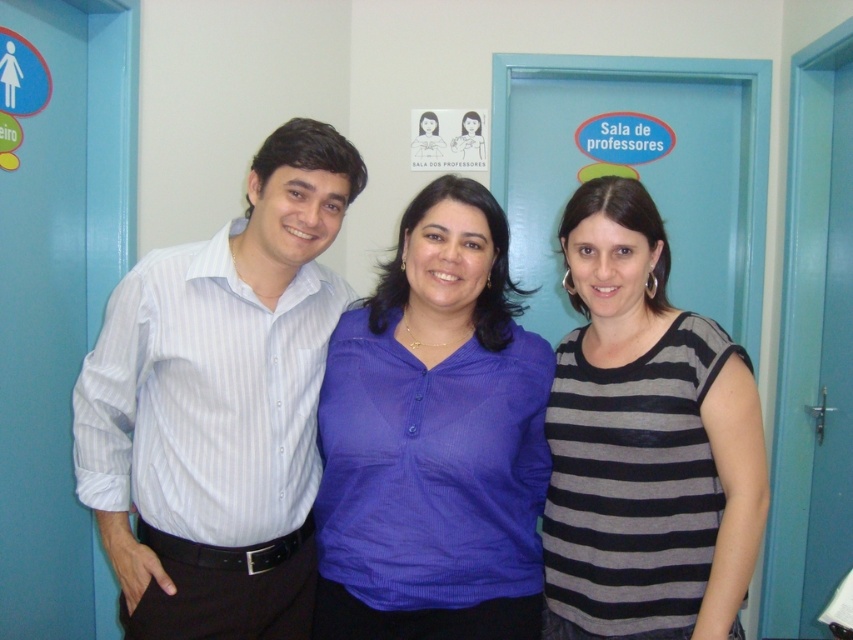
Question: Estimate the real-world distances between objects in this image. Which object is closer to the striped cotton shirt at right?

Choices:
 (A) matte blue blouse at center
 (B) white striped shirt at center

Answer: (A)

Question: In this image, where is white striped shirt at center located relative to striped cotton shirt at right?

Choices:
 (A) below
 (B) above

Answer: (B)

Question: Which of the following is the farthest from the observer?

Choices:
 (A) white striped shirt at center
 (B) striped cotton shirt at right
 (C) matte blue blouse at center

Answer: (A)

Question: Does white striped shirt at center have a larger size compared to matte blue blouse at center?

Choices:
 (A) yes
 (B) no

Answer: (A)

Question: Is white striped shirt at center to the left of matte blue blouse at center from the viewer's perspective?

Choices:
 (A) yes
 (B) no

Answer: (A)

Question: Estimate the real-world distances between objects in this image. Which object is closer to the matte blue blouse at center?

Choices:
 (A) striped cotton shirt at right
 (B) white striped shirt at center

Answer: (A)